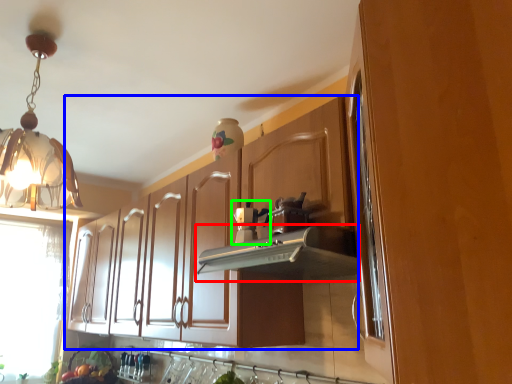
Question: Considering the real-world distances, which object is farthest from vent (highlighted by a red box)? cabinetry (highlighted by a blue box) or coffee machine (highlighted by a green box)?

Choices:
 (A) cabinetry
 (B) coffee machine

Answer: (A)